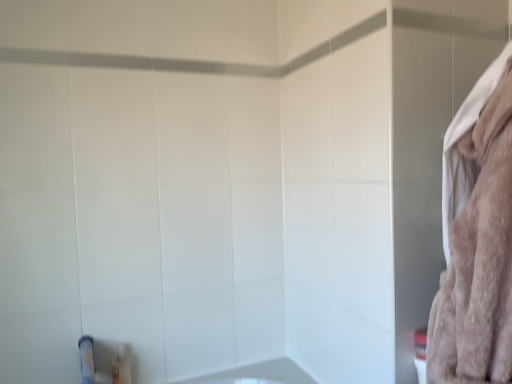
You are a GUI agent. You are given a task and a screenshot of the screen. Output one action in this format:
    pyautogui.click(x=<x>, y=<y>)
    Task: Click on the fluffy pink towel at right
    
    Given the screenshot: What is the action you would take?
    pyautogui.click(x=477, y=236)

Measure the distance between point (495, 161) and camera.

The distance of point (495, 161) from camera is 31.26 inches.

What do you see at coordinates (477, 236) in the screenshot? I see `fluffy pink towel at right` at bounding box center [477, 236].

Where is `translucent plastic tube at lower left`? The width and height of the screenshot is (512, 384). translucent plastic tube at lower left is located at coordinates (121, 368).

Measure the distance between translucent plastic tube at lower left and camera.

They are 1.66 meters apart.

The image size is (512, 384). What do you see at coordinates (121, 368) in the screenshot? I see `translucent plastic tube at lower left` at bounding box center [121, 368].

Measure the distance between point (121, 381) and camera.

The distance of point (121, 381) from camera is 5.48 feet.

Identify the location of fluffy pink towel at right. This screenshot has width=512, height=384. (477, 236).

Considering the positions of objects translucent plastic tube at lower left and fluffy pink towel at right in the image provided, who is more to the left, translucent plastic tube at lower left or fluffy pink towel at right?

translucent plastic tube at lower left is more to the left.

Which is behind, translucent plastic tube at lower left or fluffy pink towel at right?

Positioned behind is translucent plastic tube at lower left.

Considering the points (129, 363) and (498, 309), which point is behind, point (129, 363) or point (498, 309)?

The point (129, 363) is farther.

From the image's perspective, relative to fluffy pink towel at right, is translucent plastic tube at lower left above or below?

Based on their image positions, translucent plastic tube at lower left is located beneath fluffy pink towel at right.

From a real-world perspective, between translucent plastic tube at lower left and fluffy pink towel at right, who is vertically higher?

From a 3D spatial view, fluffy pink towel at right is above.

Between translucent plastic tube at lower left and fluffy pink towel at right, which one has larger width?

Wider between the two is fluffy pink towel at right.

Is translucent plastic tube at lower left shorter than fluffy pink towel at right?

Yes.

Who is bigger, translucent plastic tube at lower left or fluffy pink towel at right?

fluffy pink towel at right.

Based on the photo, is translucent plastic tube at lower left completely or partially outside of fluffy pink towel at right?

Yes, translucent plastic tube at lower left is outside of fluffy pink towel at right.

Would you say translucent plastic tube at lower left is a long distance from fluffy pink towel at right?

Indeed, translucent plastic tube at lower left is not near fluffy pink towel at right.

Could you tell me if translucent plastic tube at lower left is turned towards fluffy pink towel at right?

No, translucent plastic tube at lower left does not turn towards fluffy pink towel at right.

Can you tell me how much translucent plastic tube at lower left and fluffy pink towel at right differ in facing direction?

The angle between the facing direction of translucent plastic tube at lower left and the facing direction of fluffy pink towel at right is 167 degrees.

Measure the distance from translucent plastic tube at lower left to fluffy pink towel at right.

translucent plastic tube at lower left and fluffy pink towel at right are 4.50 feet apart from each other.

Where is `toiletry below the fluffy pink towel at right (from a real-world perspective)`? The height and width of the screenshot is (384, 512). toiletry below the fluffy pink towel at right (from a real-world perspective) is located at coordinates (121, 368).

Does fluffy pink towel at right appear on the left side of translucent plastic tube at lower left?

Incorrect, fluffy pink towel at right is not on the left side of translucent plastic tube at lower left.

Which object is closer to the camera taking this photo, fluffy pink towel at right or translucent plastic tube at lower left?

fluffy pink towel at right is more forward.

Which is less distant, [465,248] or [118,375]?

Clearly, point [465,248] is closer to the camera than point [118,375].

From the image's perspective, is fluffy pink towel at right above or below translucent plastic tube at lower left?

From the image's perspective, fluffy pink towel at right appears above translucent plastic tube at lower left.

From a real-world perspective, between fluffy pink towel at right and translucent plastic tube at lower left, who is vertically higher?

fluffy pink towel at right, from a real-world perspective.

Considering the relative sizes of fluffy pink towel at right and translucent plastic tube at lower left in the image provided, is fluffy pink towel at right thinner than translucent plastic tube at lower left?

No.

Considering the relative sizes of fluffy pink towel at right and translucent plastic tube at lower left in the image provided, is fluffy pink towel at right taller than translucent plastic tube at lower left?

Indeed, fluffy pink towel at right has a greater height compared to translucent plastic tube at lower left.

In the scene shown: Considering the sizes of fluffy pink towel at right and translucent plastic tube at lower left in the image, is fluffy pink towel at right bigger or smaller than translucent plastic tube at lower left?

Clearly, fluffy pink towel at right is larger in size than translucent plastic tube at lower left.

Is fluffy pink towel at right situated inside translucent plastic tube at lower left or outside?

fluffy pink towel at right is not enclosed by translucent plastic tube at lower left.

Would you consider fluffy pink towel at right to be distant from translucent plastic tube at lower left?

fluffy pink towel at right is far away from translucent plastic tube at lower left.

Could you tell me if fluffy pink towel at right is turned towards translucent plastic tube at lower left?

Yes.

You are a GUI agent. You are given a task and a screenshot of the screen. Output one action in this format:
    pyautogui.click(x=<x>, y=<y>)
    Task: Click on the bath towel above the translucent plastic tube at lower left (from the image's perspective)
    
    Given the screenshot: What is the action you would take?
    pyautogui.click(x=477, y=236)

The height and width of the screenshot is (384, 512). What are the coordinates of `bath towel above the translucent plastic tube at lower left (from the image's perspective)` in the screenshot? It's located at (477, 236).

There is a translucent plastic tube at lower left. Find the location of `bath towel above it (from a real-world perspective)`. bath towel above it (from a real-world perspective) is located at coordinates (477, 236).